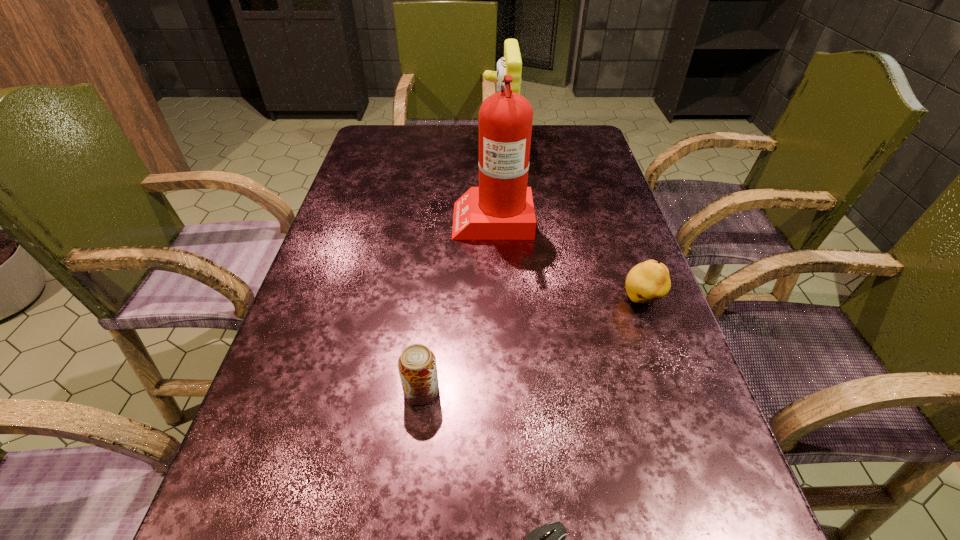
In order to click on free space at the far left corner in this screenshot , I will do `click(387, 136)`.

This screenshot has width=960, height=540. In order to click on vacant region at the far right corner of the desktop in this screenshot , I will do `click(548, 152)`.

Where is `vacant space that is in between the third farthest object and the second tallest object`? vacant space that is in between the third farthest object and the second tallest object is located at coordinates (570, 224).

Where is `free space between the leftmost object and the sponge`? free space between the leftmost object and the sponge is located at coordinates (460, 269).

Where is `free space that is in between the tallest object and the leftmost object`? free space that is in between the tallest object and the leftmost object is located at coordinates (457, 304).

Select which object appears as the fourth closest to the third nearest object. Please provide its 2D coordinates. Your answer should be formatted as a tuple, i.e. [(x, y)], where the tuple contains the x and y coordinates of a point satisfying the conditions above.

[(510, 64)]

Identify which object is located as the third nearest to the nearest object. Please provide its 2D coordinates. Your answer should be formatted as a tuple, i.e. [(x, y)], where the tuple contains the x and y coordinates of a point satisfying the conditions above.

[(501, 208)]

At what (x,y) coordinates should I click in order to perform the action: click on vacant area in the image that satisfies the following two spatial constraints: 1. on the face of the pear; 2. on the right side of the sponge. Please return your answer as a coordinate pair (x, y). Looking at the image, I should click on (508, 300).

Identify the location of vacant space that satisfies the following two spatial constraints: 1. on the face of the rightmost object; 2. on the right side of the fourth shortest object. The width and height of the screenshot is (960, 540). (508, 300).

Locate an element on the screen. vacant space that satisfies the following two spatial constraints: 1. on the front-facing side of the rightmost object; 2. on the right side of the tallest object is located at coordinates (495, 300).